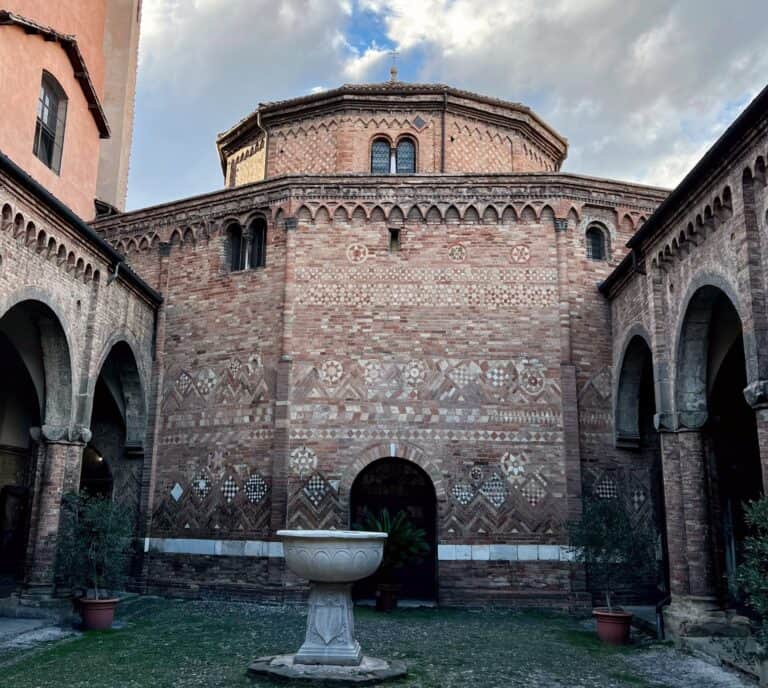
The width and height of the screenshot is (768, 688). In order to click on middle dark doorway in this screenshot , I will do `click(389, 512)`.